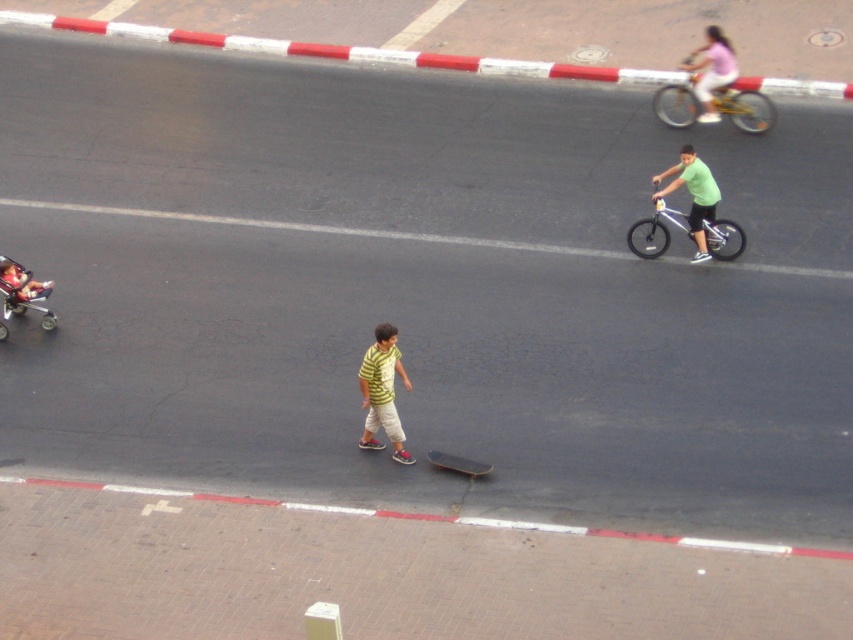
Is the position of yellow metallic bicycle at upper right less distant than that of silver metallic bicycle at center right?

No, it is behind silver metallic bicycle at center right.

Who is more forward, (x=660, y=116) or (x=729, y=221)?

Positioned in front is point (x=729, y=221).

Locate an element on the screen. The image size is (853, 640). yellow metallic bicycle at upper right is located at coordinates (746, 108).

Is point (724, 77) more distant than point (477, 476)?

Yes.

Who is lower down, pink fabric shirt at upper right or smooth black skateboard at center?

smooth black skateboard at center

Is point (701, 100) positioned in front of point (434, 456)?

No, it is not.

You are a GUI agent. You are given a task and a screenshot of the screen. Output one action in this format:
    pyautogui.click(x=<x>, y=<y>)
    Task: Click on the pink fabric shirt at upper right
    
    Given the screenshot: What is the action you would take?
    pyautogui.click(x=711, y=70)

Does green matte shirt at center have a greater width compared to pink fabric shirt at upper right?

Yes, green matte shirt at center is wider than pink fabric shirt at upper right.

Who is higher up, green matte shirt at center or pink fabric shirt at upper right?

pink fabric shirt at upper right is above.

Identify the location of green matte shirt at center. The height and width of the screenshot is (640, 853). (693, 195).

Find the location of a particular element. green matte shirt at center is located at coordinates pos(693,195).